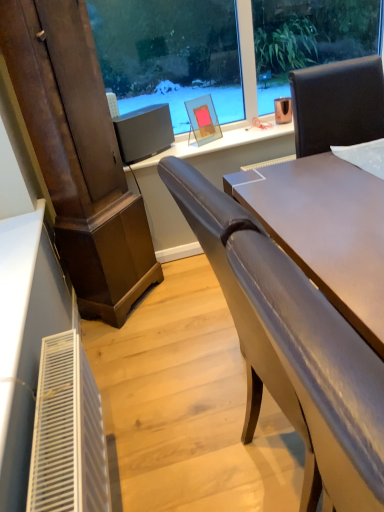
Question: Is matte gray chair at center not near matte glass picture frame at center?

Choices:
 (A) no
 (B) yes

Answer: (B)

Question: Is matte gray chair at center oriented towards matte glass picture frame at center?

Choices:
 (A) no
 (B) yes

Answer: (A)

Question: Can you confirm if matte gray chair at center is wider than matte glass picture frame at center?

Choices:
 (A) no
 (B) yes

Answer: (B)

Question: From the image's perspective, is matte gray chair at center located above matte glass picture frame at center?

Choices:
 (A) no
 (B) yes

Answer: (A)

Question: Considering the relative sizes of matte gray chair at center and matte glass picture frame at center in the image provided, is matte gray chair at center taller than matte glass picture frame at center?

Choices:
 (A) no
 (B) yes

Answer: (B)

Question: Is matte gray chair at center next to matte glass picture frame at center?

Choices:
 (A) no
 (B) yes

Answer: (A)

Question: Does matte black monitor at center come behind matte glass picture frame at center?

Choices:
 (A) yes
 (B) no

Answer: (B)

Question: Is the position of matte black monitor at center less distant than that of matte glass picture frame at center?

Choices:
 (A) yes
 (B) no

Answer: (A)

Question: From the image's perspective, would you say matte black monitor at center is shown under matte glass picture frame at center?

Choices:
 (A) no
 (B) yes

Answer: (B)

Question: From a real-world perspective, is matte black monitor at center located higher than matte glass picture frame at center?

Choices:
 (A) no
 (B) yes

Answer: (A)

Question: Is matte black monitor at center at the left side of matte glass picture frame at center?

Choices:
 (A) no
 (B) yes

Answer: (B)

Question: Considering the relative sizes of matte black monitor at center and matte glass picture frame at center in the image provided, is matte black monitor at center thinner than matte glass picture frame at center?

Choices:
 (A) no
 (B) yes

Answer: (A)

Question: Is matte glass picture frame at center oriented towards matte gray chair at center?

Choices:
 (A) no
 (B) yes

Answer: (A)